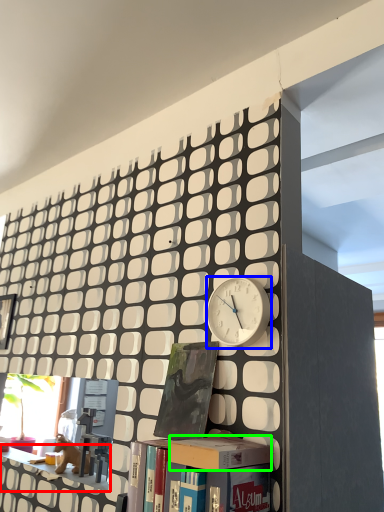
Question: Which object is the closest to the shelf (highlighted by a red box)? Choose among these: clock (highlighted by a blue box) or box (highlighted by a green box).

Choices:
 (A) clock
 (B) box

Answer: (B)